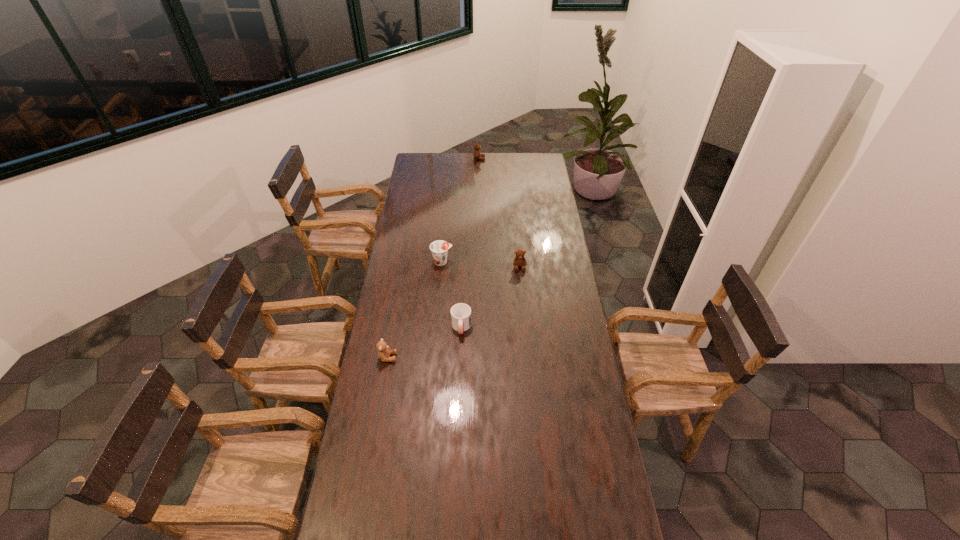
Locate an element on the screen. This screenshot has width=960, height=540. blank space that satisfies the following two spatial constraints: 1. on the side of the mug with the handle; 2. on the face of the leftmost object is located at coordinates (460, 357).

This screenshot has width=960, height=540. I want to click on free space that satisfies the following two spatial constraints: 1. on the face of the rightmost object; 2. on the face of the leftmost teddy bear, so click(x=528, y=357).